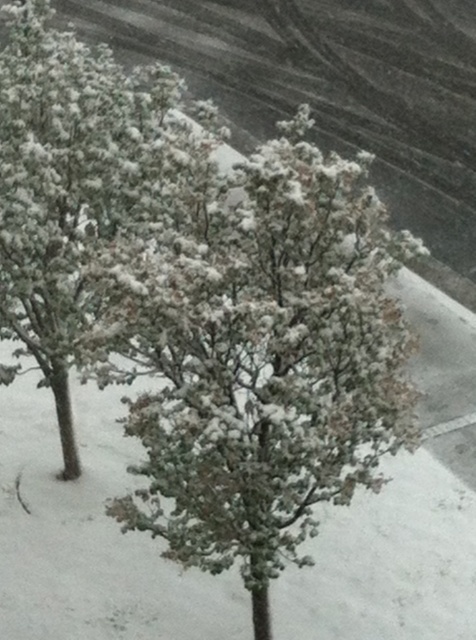
Is snow-covered tree at center above white fluffy tree at center?

No.

Which is in front, point (151, 353) or point (129, 164)?

Point (151, 353) is in front.

At what (x,y) coordinates should I click in order to perform the action: click on snow-covered tree at center. Please return your answer as a coordinate pair (x, y). Looking at the image, I should click on (266, 362).

I want to click on snow-covered tree at center, so click(266, 362).